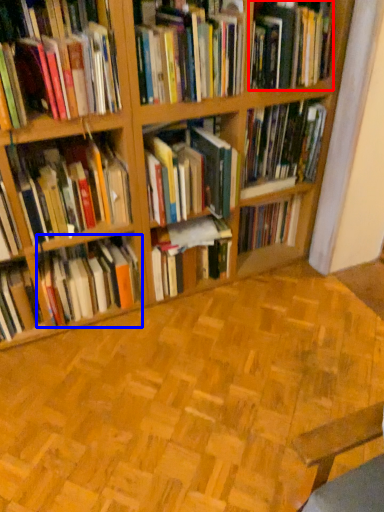
Question: Which of the following is the farthest to the observer, book (highlighted by a red box) or book (highlighted by a blue box)?

Choices:
 (A) book
 (B) book

Answer: (B)